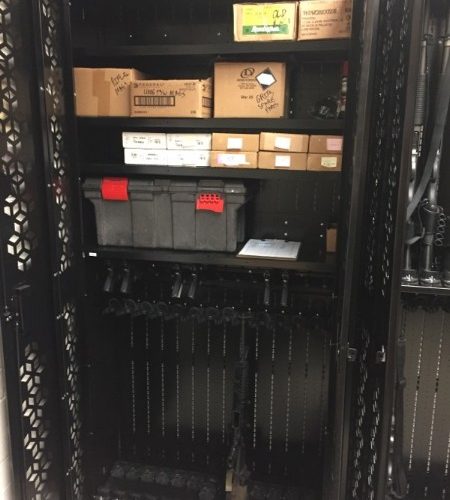
Locate an element on the screen. two boxes on top shelf is located at coordinates (279, 31), (326, 25).